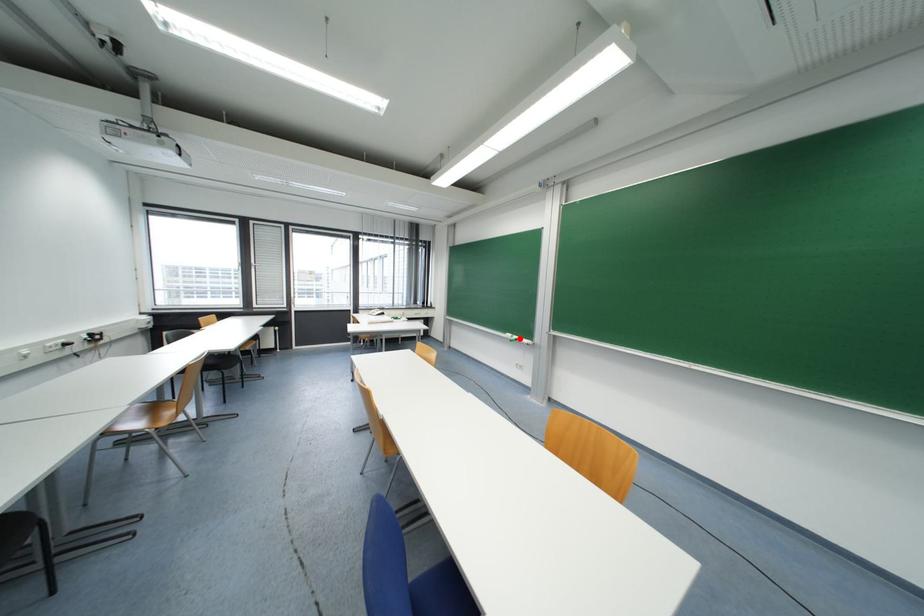
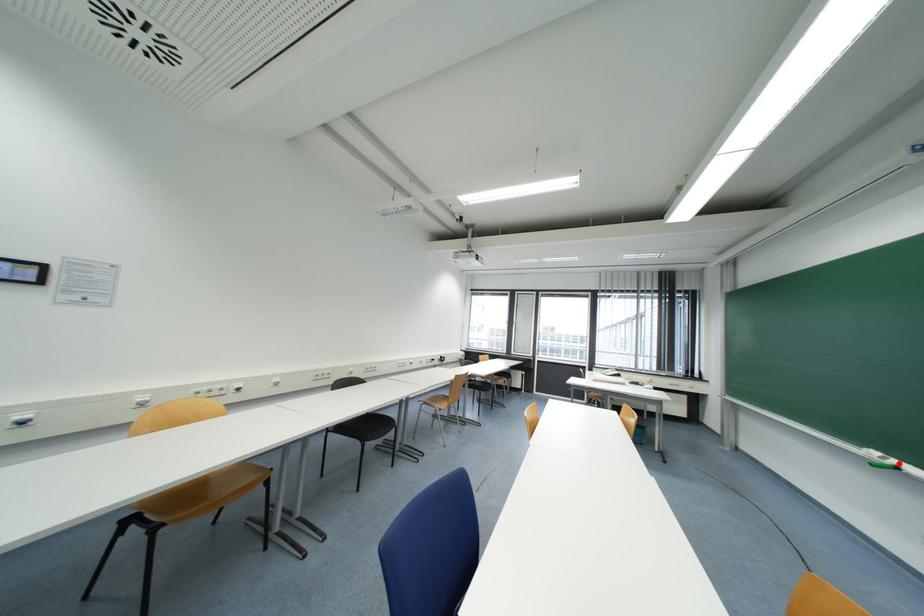
I am providing you with two images of the same scene from different viewpoints. A red point is marked on the first image and another point is marked on the second image. Is the red point in image1 aligned with the point shown in image2?

Yes